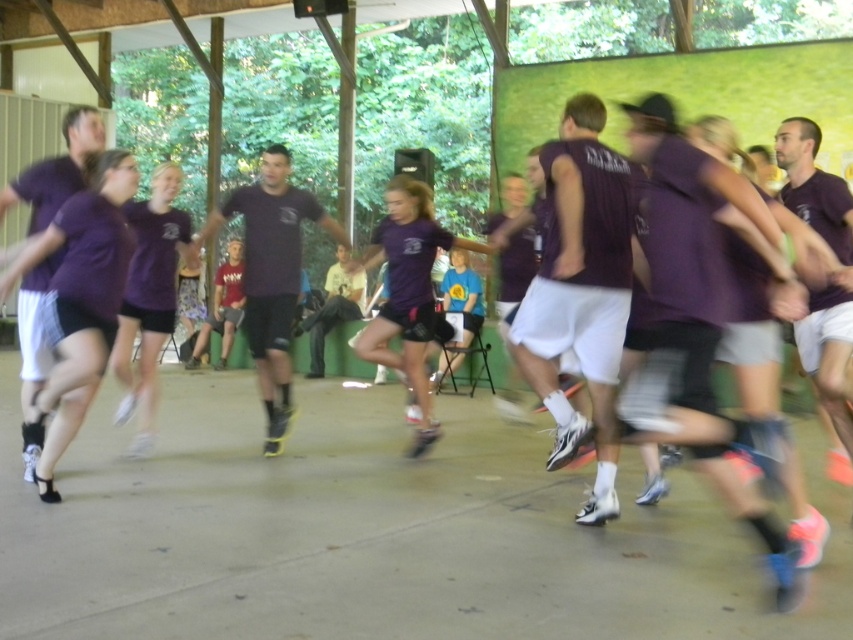
You are observing a group of dancers performing in an outdoor pavilion. You notice two sets of purple matte shorts at left and purple matte shorts at center. Based on their positions, which set of purple shorts is higher up?

The purple matte shorts at left is located above the purple matte shorts at center, so the one at left is higher up.

From the picture: You are a photographer trying to capture a closeup of the point at position (53, 348) and the point at position (155, 285). Which point should you focus on to ensure it appears clearer in the photo?

The point at position (53, 348) is closer to the camera than point at position (155, 285), so focusing on it will make it appear clearer in the photo.